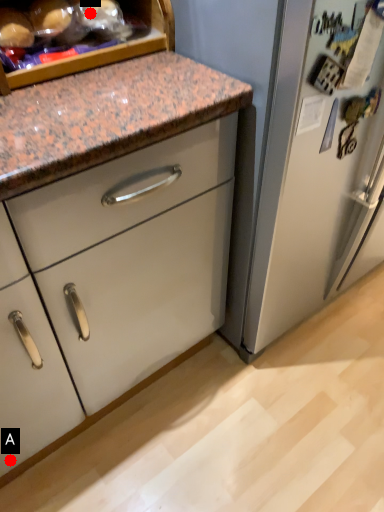
Question: Two points are circled on the image, labeled by A and B beside each circle. Which point appears closest to the camera in this image?

Choices:
 (A) A is closer
 (B) B is closer

Answer: (B)